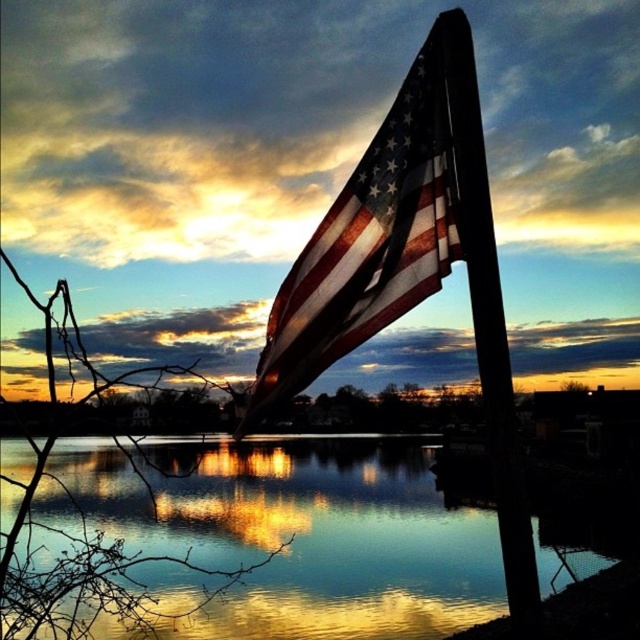
You are a photographer trying to capture the sunset scene. You notice the reflective glass water at center and the worn fabric flag at upper center. Which object appears taller in the image?

The reflective glass water at center has a greater height compared to the worn fabric flag at upper center, so the reflective glass water at center appears taller in the image.

You are standing in front of the sunset scene. You want to take a photo of the worn fabric flag at upper center without the reflective glass water at center appearing in the foreground. Is this possible?

The reflective glass water at center is closer to the viewer than the worn fabric flag at upper center, so it will block the view of the flag. Therefore, it is not possible to take a photo of the worn fabric flag at upper center without the reflective glass water at center appearing in the foreground.